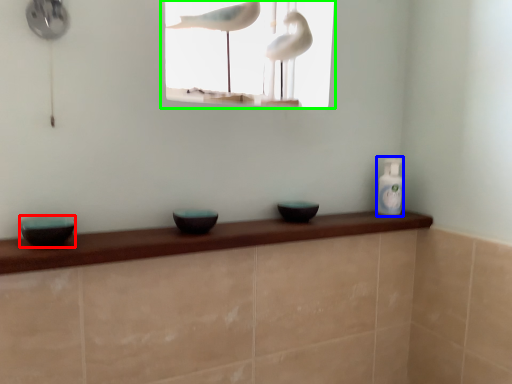
Question: Considering the real-world distances, which object is farthest from basin (highlighted by a red box)? bottle (highlighted by a blue box) or window (highlighted by a green box)?

Choices:
 (A) bottle
 (B) window

Answer: (B)